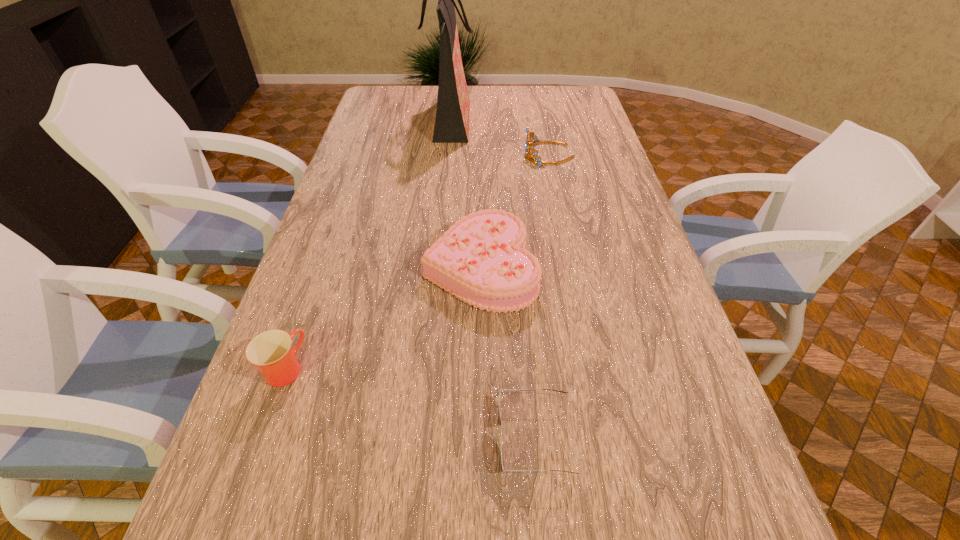
Locate an element on the screen. The image size is (960, 540). vacant space at the left edge of the desktop is located at coordinates (333, 280).

This screenshot has height=540, width=960. I want to click on vacant space at the right edge of the desktop, so click(x=563, y=134).

The width and height of the screenshot is (960, 540). In order to click on vacant space at the far left corner of the desktop in this screenshot , I will do `click(399, 109)`.

Image resolution: width=960 pixels, height=540 pixels. I want to click on vacant point located between the sunglasses and the third nearest object, so click(x=508, y=352).

At what (x,y) coordinates should I click in order to perform the action: click on free spot between the sunglasses and the leftmost object. Please return your answer as a coordinate pair (x, y). The width and height of the screenshot is (960, 540). Looking at the image, I should click on (411, 403).

In order to click on free space between the third nearest object and the cup in this screenshot , I will do `click(383, 318)`.

This screenshot has height=540, width=960. I want to click on vacant region between the cake and the shopping bag, so click(466, 195).

You are a GUI agent. You are given a task and a screenshot of the screen. Output one action in this format:
    pyautogui.click(x=<x>, y=<y>)
    Task: Click on the vacant region between the third farthest object and the tiara
    The height and width of the screenshot is (540, 960).
    Given the screenshot: What is the action you would take?
    pyautogui.click(x=515, y=211)

The width and height of the screenshot is (960, 540). I want to click on vacant area between the cake and the shortest object, so click(x=508, y=352).

The height and width of the screenshot is (540, 960). Identify the location of object that is the third closest to the tallest object. (271, 351).